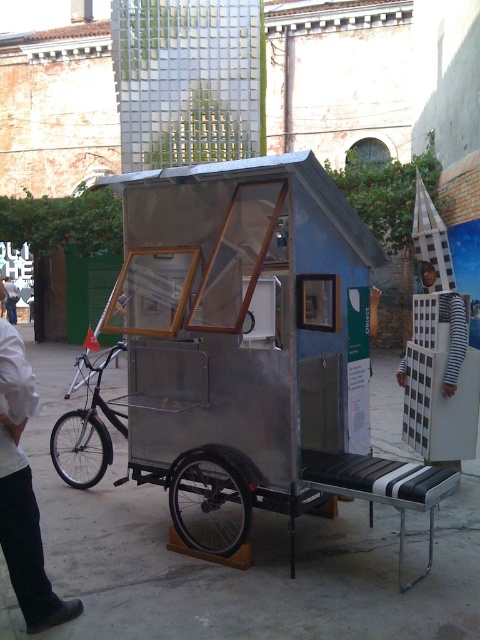
You are standing in front of a mobile structure and notice a silver metallic wheel at lower center and a white striped shirt at lower right. Which object is positioned lower in the image?

The silver metallic wheel at lower center is located below the white striped shirt at lower right, so it is positioned lower in the image.

You are a delivery person who needs to maneuver through a narrow alley that is only 1.2 meters wide. You have to decide whether the metallic silver tricycle at center and the silver metallic wheel at lower center can both fit side by side in the alley. Which object is wider and would determine if they can fit together?

The metallic silver tricycle at center is wider than the silver metallic wheel at lower center according to the description. To determine if both can fit side by side in the 1.2 meter alley, you need to consider the combined width of both objects. However, since the tricycle is wider, its width alone must be less than 1.2 meters for them to fit together. If the tricycle is already wider than 1.2 meters, they cannot fit even without the wheel. If the tricycle is narrower, adding the wheel might exceed the 1.